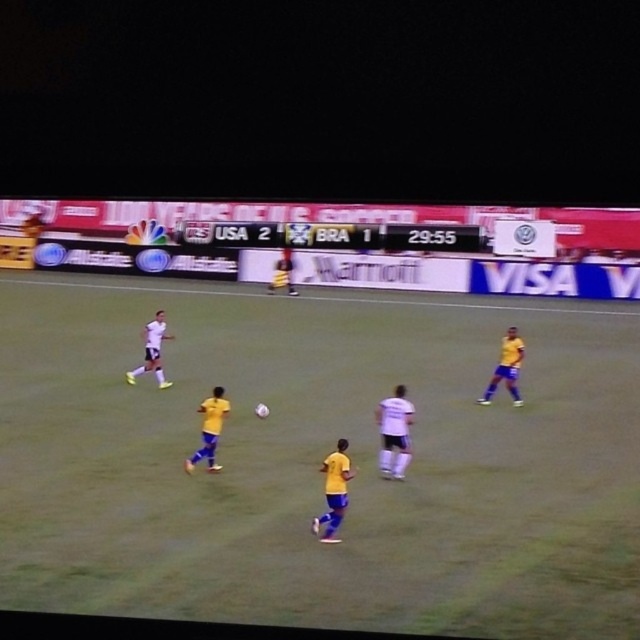
Can you confirm if white matte jersey at center is positioned to the right of yellow matte soccer player at center?

Correct, you'll find white matte jersey at center to the right of yellow matte soccer player at center.

Which of these two, white matte jersey at center or yellow matte soccer player at center, stands taller?

Standing taller between the two is white matte jersey at center.

You are a GUI agent. You are given a task and a screenshot of the screen. Output one action in this format:
    pyautogui.click(x=<x>, y=<y>)
    Task: Click on the white matte jersey at center
    The image size is (640, 640).
    Given the screenshot: What is the action you would take?
    pyautogui.click(x=394, y=433)

What do you see at coordinates (209, 429) in the screenshot? I see `yellow matte soccer player at center` at bounding box center [209, 429].

Who is positioned more to the left, yellow matte soccer player at center or yellow jersey at center?

yellow jersey at center is more to the left.

Who is more forward, (220, 467) or (282, 285)?

Positioned in front is point (220, 467).

Where is `yellow matte soccer player at center`? The width and height of the screenshot is (640, 640). yellow matte soccer player at center is located at coordinates (209, 429).

Is point (166, 337) behind point (288, 260)?

No, it is in front of (288, 260).

Is point (150, 332) more distant than point (288, 282)?

No.

Locate an element on the screen. This screenshot has width=640, height=640. white matte soccer player at left is located at coordinates (152, 352).